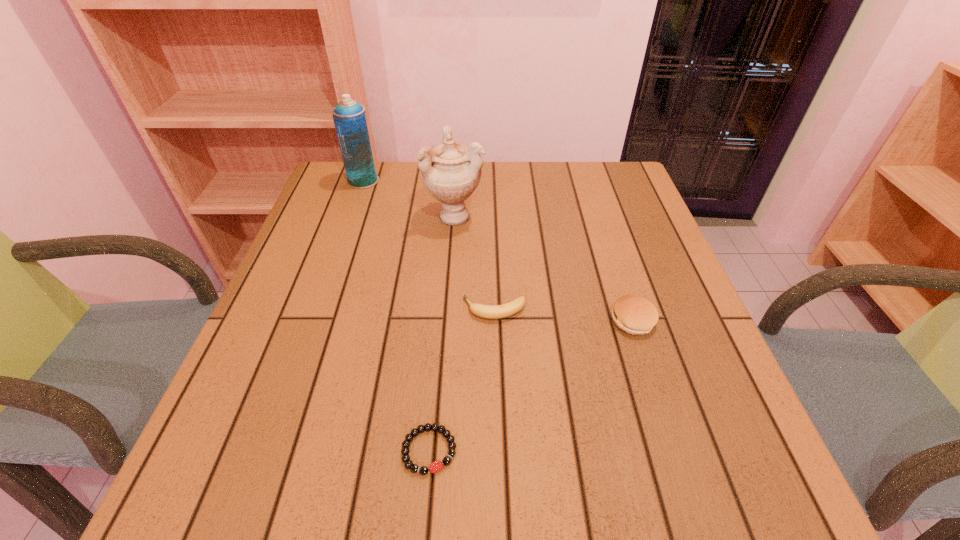
Locate an element on the screen. This screenshot has height=540, width=960. vacant area located 0.170m on the front of the patty is located at coordinates (664, 417).

Locate an element on the screen. blank area located at the stem of the banana is located at coordinates (324, 309).

This screenshot has height=540, width=960. Find the location of `vacant space located 0.390m at the stem of the banana`. vacant space located 0.390m at the stem of the banana is located at coordinates click(276, 309).

Find the location of a particular element. This screenshot has width=960, height=540. blank area located 0.350m at the stem of the banana is located at coordinates (296, 309).

Find the location of a particular element. The height and width of the screenshot is (540, 960). free space located 0.130m on the right of the nearest object is located at coordinates (538, 450).

You are a GUI agent. You are given a task and a screenshot of the screen. Output one action in this format:
    pyautogui.click(x=<x>, y=<y>)
    Task: Click on the aerosol can located at the far edge
    
    Given the screenshot: What is the action you would take?
    pyautogui.click(x=349, y=118)

The image size is (960, 540). I want to click on urn present at the far edge, so click(x=451, y=172).

Where is `object that is at the near edge`? The height and width of the screenshot is (540, 960). object that is at the near edge is located at coordinates coord(414,468).

This screenshot has height=540, width=960. Identify the location of object located in the left edge section of the desktop. click(349, 118).

Identify the location of object situated at the right edge. The height and width of the screenshot is (540, 960). (636, 315).